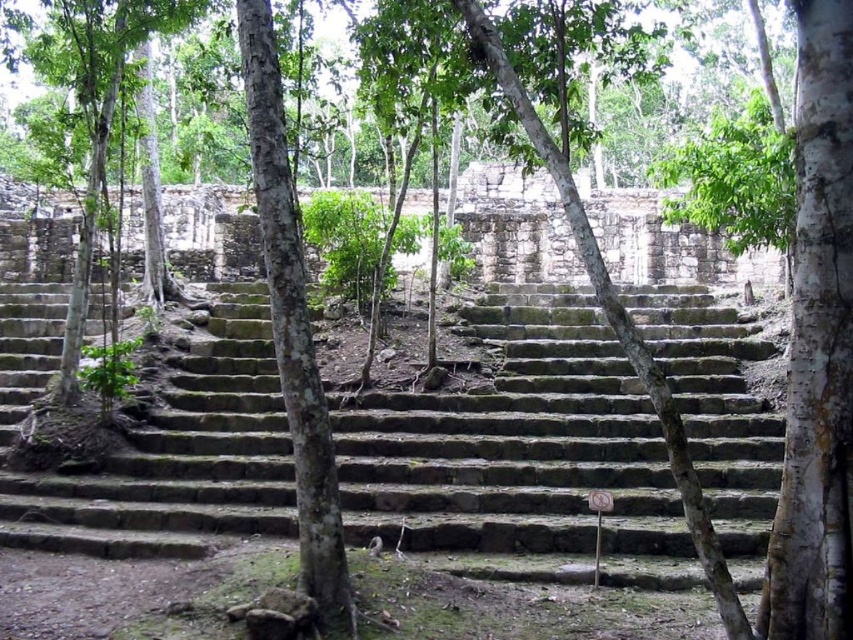
You are a hiker who wants to climb the green mossy stone stairs at center to reach the ruins. However, you notice the green rough bark tree at center nearby. Which object is shorter in height between the two?

The green mossy stone stairs at center has a lesser height compared to the green rough bark tree at center, so the stairs are shorter.

You are an archaeologist examining the ancient stone staircase leading to the ruins. You notice two trees flanking the staircase. Which tree, the white textured bark at right or the green rough bark tree at center, is positioned higher up relative to the staircase?

The white textured bark at right is positioned higher up relative to the staircase because it is located above the green rough bark tree at center.

You are an archaeologist standing at the bottom of the green mossy stone stairs at center. You want to walk towards the green rough bark tree at center. How many steps will you need to climb to reach the tree?

The green mossy stone stairs at center is 18.04 feet from the green rough bark tree at center. Assuming each step is about 7 inches tall, you would need to climb approximately 31 steps to reach the tree.